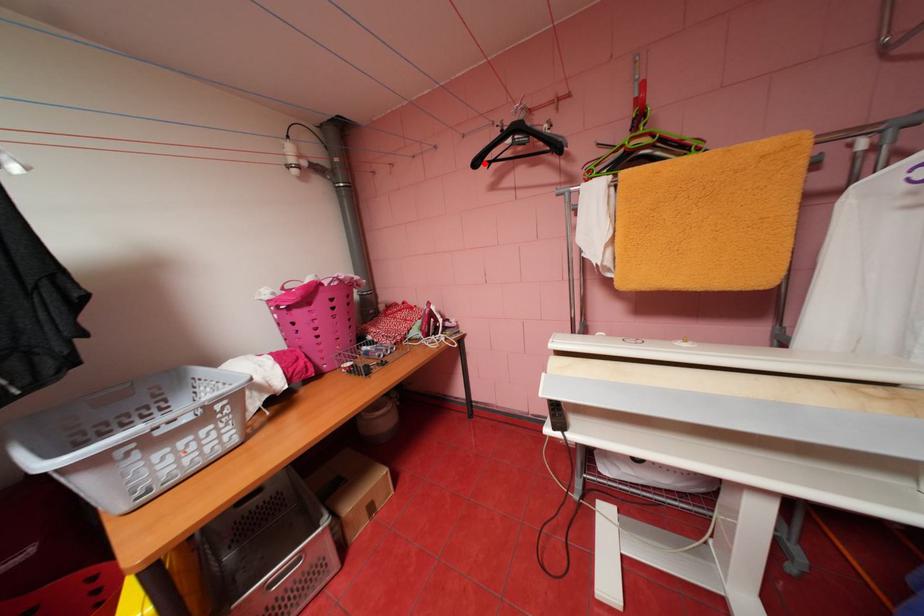
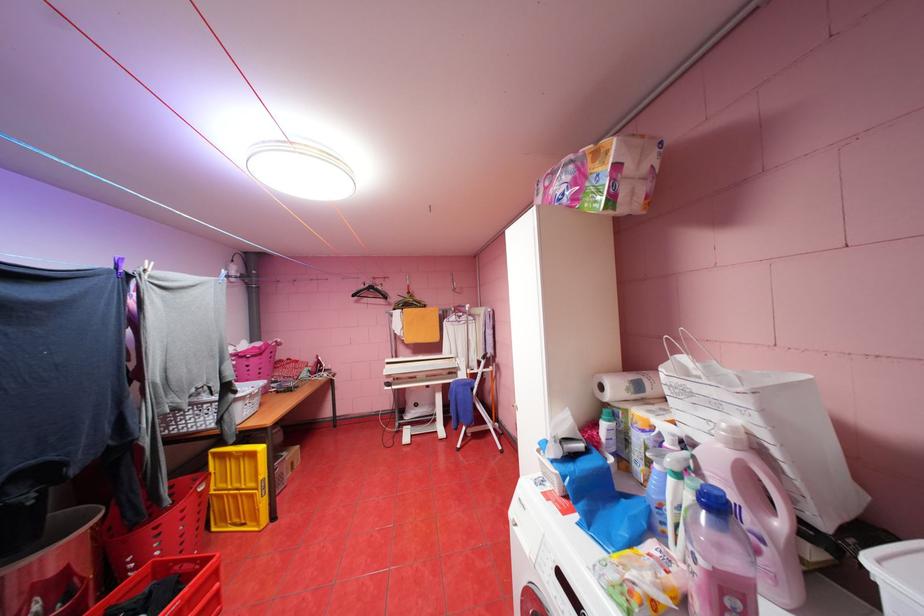
In the second image, find the point that corresponds to the highlighted location in the first image.

(361, 294)